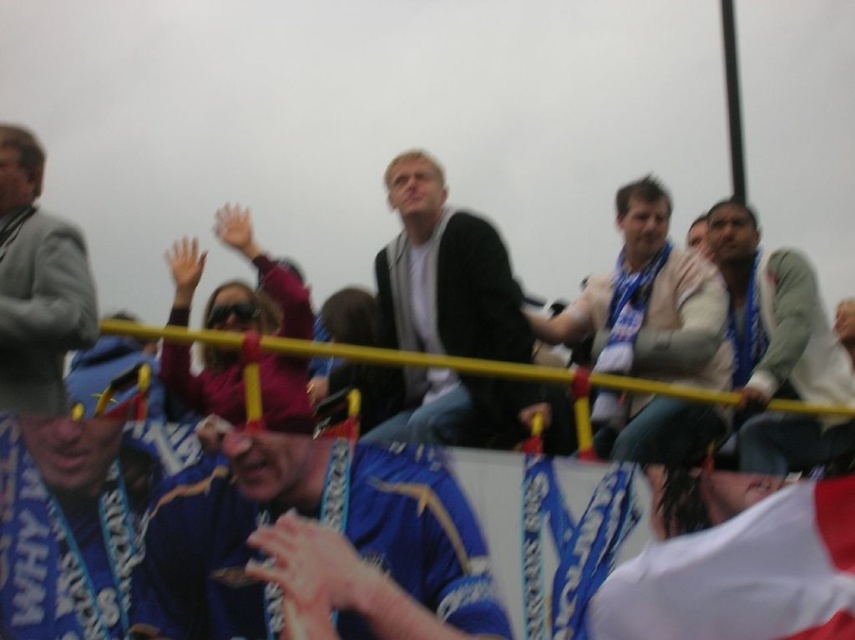
Can you confirm if blue jersey at center is positioned to the left of matte black jacket at center?

Yes, blue jersey at center is to the left of matte black jacket at center.

Which is above, blue jersey at center or matte black jacket at center?

matte black jacket at center is above.

Measure the distance between point [323,600] and camera.

Point [323,600] is 50.96 meters away from camera.

Identify the location of blue jersey at center. The width and height of the screenshot is (855, 640). (315, 547).

Does white scarf at center have a greater height compared to light gray sweater at upper right?

Yes, white scarf at center is taller than light gray sweater at upper right.

How far apart are white scarf at center and light gray sweater at upper right?

white scarf at center is 21.44 feet away from light gray sweater at upper right.

Where is `white scarf at center`? The image size is (855, 640). white scarf at center is located at coordinates (649, 301).

Is blue jersey at center positioned at the back of light gray sweater at upper right?

No, it is not.

Is point (174, 600) closer to viewer compared to point (818, 362)?

Yes, point (174, 600) is closer to viewer.

Identify the location of blue jersey at center. (315, 547).